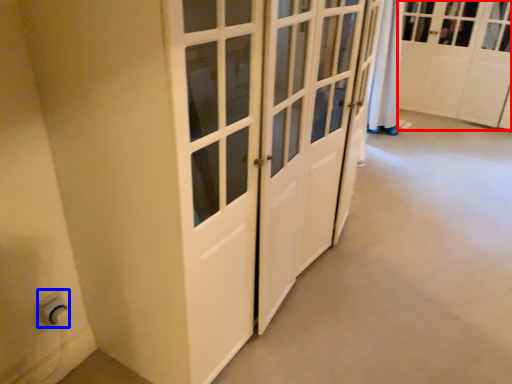
Question: Which of the following is the closest to the observer, cabinetry (highlighted by a red box) or electric outlet (highlighted by a blue box)?

Choices:
 (A) cabinetry
 (B) electric outlet

Answer: (B)